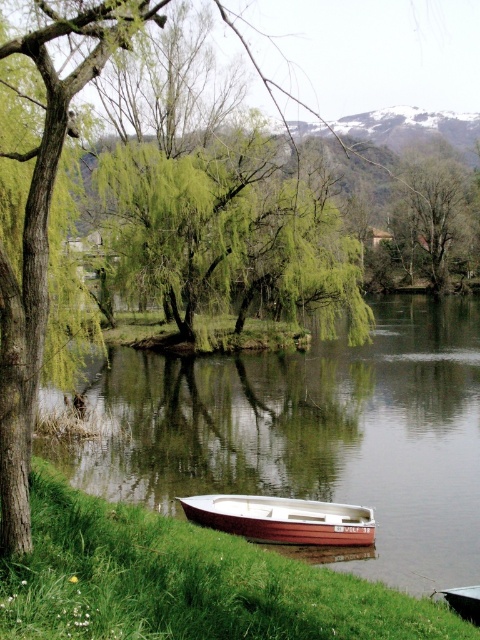
You are standing on the grassy bank near the water and want to take a photo of both the smooth brown water at lower center and the green leafy tree at center. Which object should you frame first in your camera to ensure both are in the shot?

You should frame the smooth brown water at lower center first because it is positioned to the left of the green leafy tree at center, so starting with the water ensures the tree will be included in the right side of the frame.

You are standing at the riverside and want to locate two specific points in the image. The first point is at coordinates point [189,600] and the second is at point [463,605]. Which point is closer to you?

Point [189,600] is in front of point [463,605], so the first point is closer to you.

You are planning to set up a picnic area near the white wooden boat at lower center and the green grass at lower left. Which area would be more suitable for a picnic considering the space available?

The white wooden boat at lower center has a larger size than the green grass at lower left, so the area around the white wooden boat at lower center would be more suitable for a picnic as it offers more space.